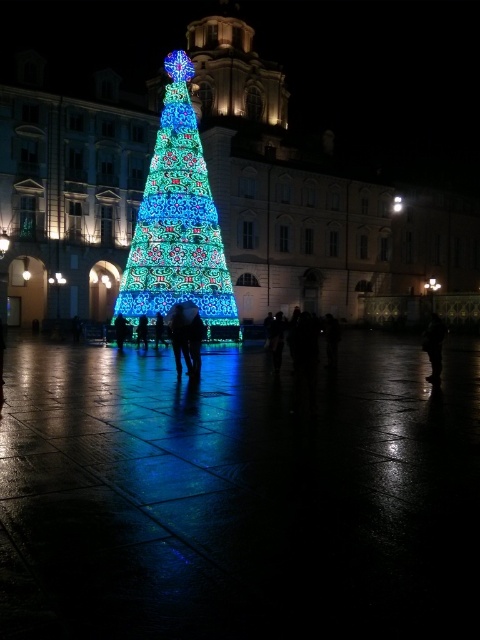
Is illuminated glass christmas tree at center to the right of black matte person at lower right from the viewer's perspective?

No, illuminated glass christmas tree at center is not to the right of black matte person at lower right.

Measure the distance between point [182,58] and camera.

A distance of 61.19 meters exists between point [182,58] and camera.

Identify the location of illuminated glass christmas tree at center. The image size is (480, 640). (179, 224).

Who is taller, illuminated plastic christmas tree at center or smooth black figure at center?

With more height is smooth black figure at center.

Can you confirm if illuminated plastic christmas tree at center is thinner than smooth black figure at center?

In fact, illuminated plastic christmas tree at center might be wider than smooth black figure at center.

Between point (427, 428) and point (176, 358), which one is positioned in front?

Point (427, 428) is more forward.

Locate an element on the screen. This screenshot has height=640, width=480. illuminated plastic christmas tree at center is located at coordinates (239, 497).

Does point (343, 636) come closer to viewer compared to point (193, 284)?

Yes, it is in front of point (193, 284).

Does point (122, 378) come behind point (180, 193)?

No, it is in front of (180, 193).

Locate an element on the screen. illuminated plastic christmas tree at center is located at coordinates (239, 497).